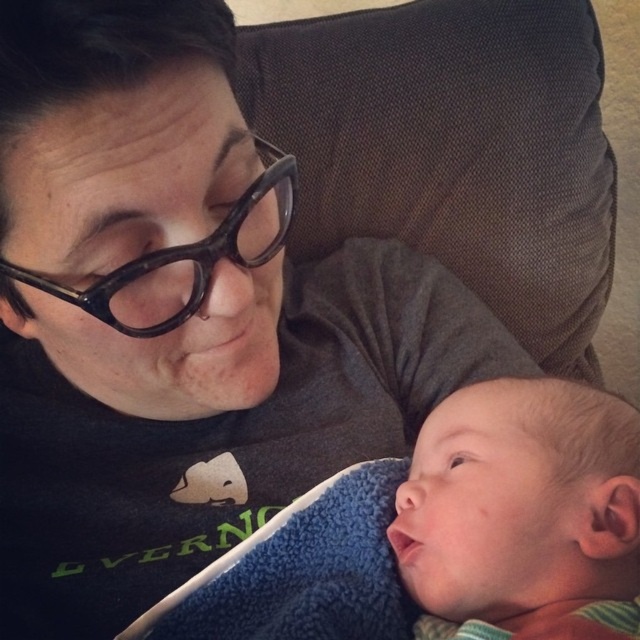
Question: Does smooth skin baby at center have a larger size compared to blue fleece blanket at lower right?

Choices:
 (A) no
 (B) yes

Answer: (B)

Question: Which object appears farthest from the camera in this image?

Choices:
 (A) smooth skin baby at center
 (B) blue fleece blanket at lower right

Answer: (B)

Question: Can you confirm if smooth skin baby at center is wider than blue fleece blanket at lower right?

Choices:
 (A) yes
 (B) no

Answer: (B)

Question: Is smooth skin baby at center further to camera compared to blue fleece blanket at lower right?

Choices:
 (A) no
 (B) yes

Answer: (A)